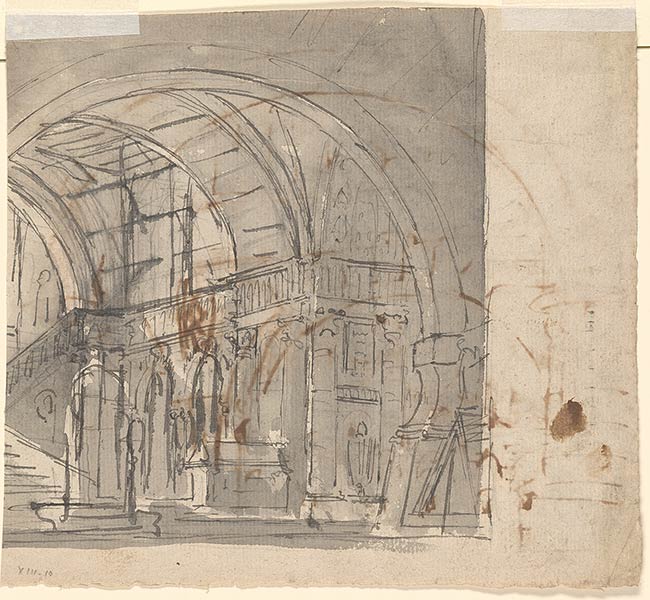
Locate an element on the screen. The image size is (650, 600). floor is located at coordinates (242, 525).